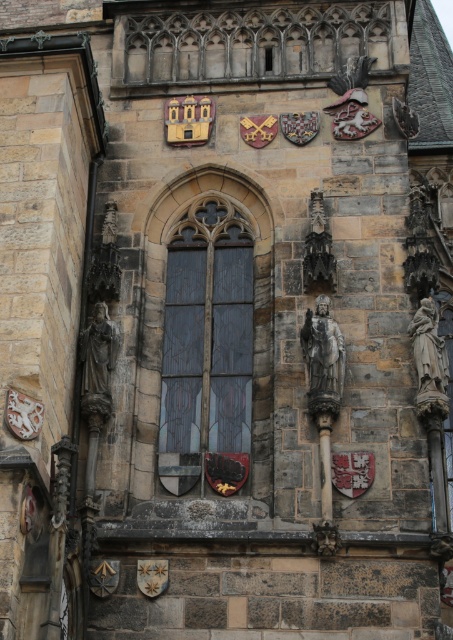
Question: Can you confirm if polished stone statue at center is positioned to the left of stone statue at left?

Choices:
 (A) yes
 (B) no

Answer: (B)

Question: Is the position of polished stone statue at center more distant than that of stone statue at right?

Choices:
 (A) yes
 (B) no

Answer: (A)

Question: Which object is farther from the camera taking this photo?

Choices:
 (A) stone statue at left
 (B) stained glass window at center
 (C) stone statue at right

Answer: (A)

Question: Which point appears closest to the camera in this image?

Choices:
 (A) (215, 467)
 (B) (316, 330)

Answer: (B)

Question: Among these objects, which one is nearest to the camera?

Choices:
 (A) stone statue at left
 (B) stained glass window at center
 (C) polished stone statue at center
 (D) stone statue at right

Answer: (D)

Question: Does polished stone statue at center appear over stone statue at left?

Choices:
 (A) yes
 (B) no

Answer: (A)